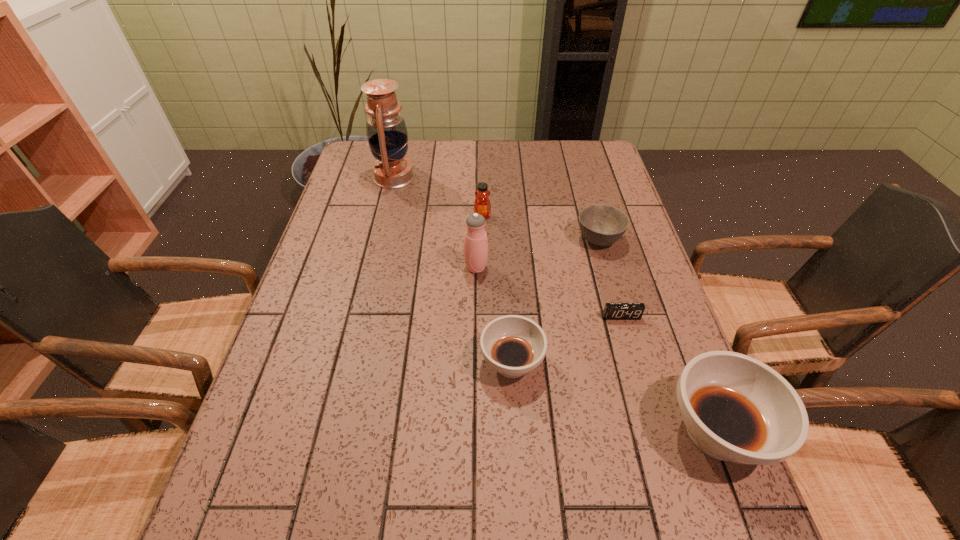
Please point a vacant point for placing a soup bowl on the left. Please provide its 2D coordinates. Your answer should be formatted as a tuple, i.e. [(x, y)], where the tuple contains the x and y coordinates of a point satisfying the conditions above.

[(348, 308)]